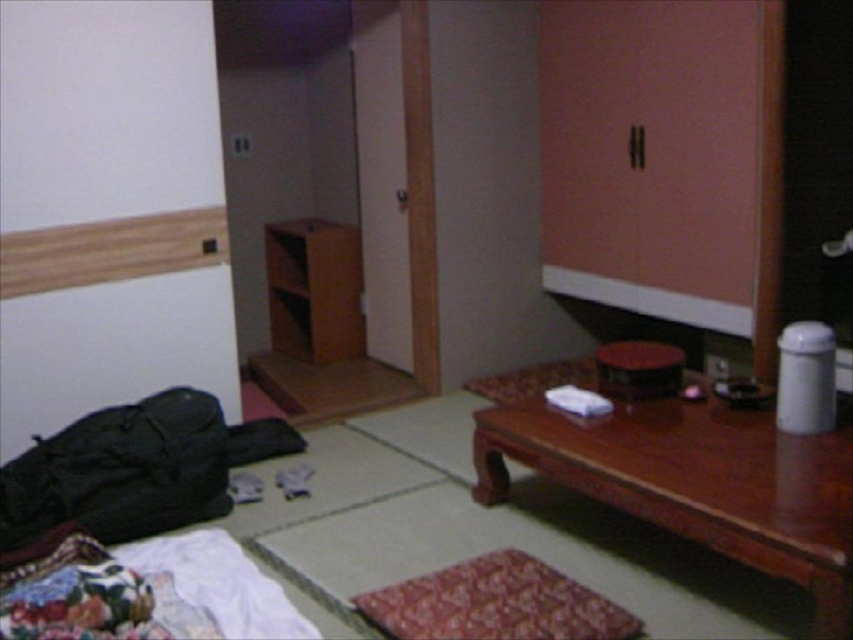
Question: Does brown wooden table at lower right appear on the left side of brown wood cabinet at center?

Choices:
 (A) yes
 (B) no

Answer: (B)

Question: Which object is closer to the camera taking this photo?

Choices:
 (A) wooden stool at center
 (B) brown wood cabinet at center
 (C) brown wooden table at lower right

Answer: (C)

Question: Is brown wooden table at lower right in front of wooden stool at center?

Choices:
 (A) yes
 (B) no

Answer: (A)

Question: Is brown wood cabinet at center further to the viewer compared to wooden stool at center?

Choices:
 (A) yes
 (B) no

Answer: (A)

Question: Which point is farther to the camera?

Choices:
 (A) brown wood cabinet at center
 (B) wooden stool at center
 (C) brown wooden table at lower right

Answer: (A)

Question: Based on their relative distances, which object is farther from the brown wood cabinet at center?

Choices:
 (A) brown wooden table at lower right
 (B) wooden stool at center

Answer: (A)